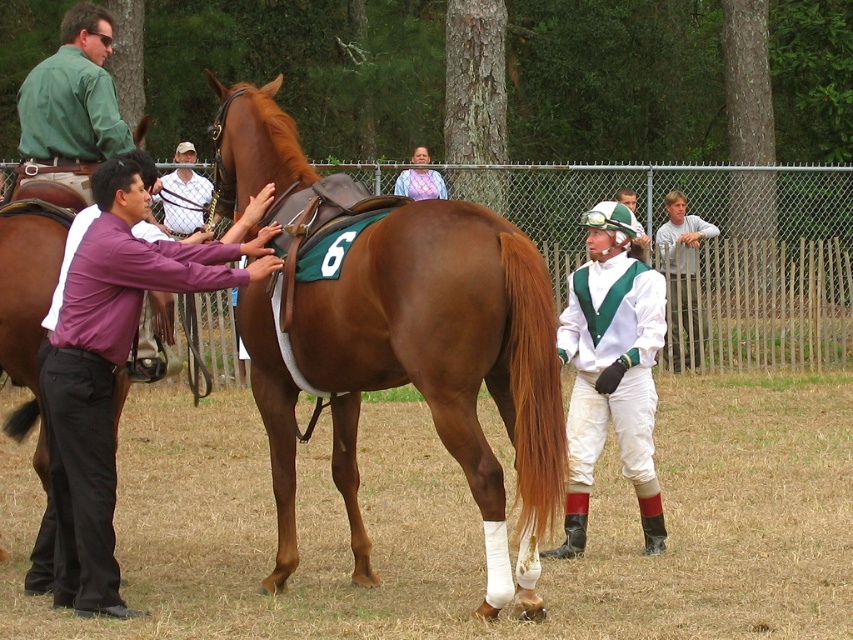
Question: Based on their relative distances, which object is farther from the white matte vest at center?

Choices:
 (A) white matte pants at center
 (B) white striped shirt at center

Answer: (B)

Question: Which object is farther from the camera taking this photo?

Choices:
 (A) pastel knitted sweater at center
 (B) white matte vest at center
 (C) green smooth shirt at upper left

Answer: (A)

Question: Does white matte pants at center appear on the left side of brown glossy saddle at left?

Choices:
 (A) no
 (B) yes

Answer: (A)

Question: Does shiny brown horse at center have a smaller size compared to white striped shirt at center?

Choices:
 (A) yes
 (B) no

Answer: (B)

Question: Can you confirm if brown glossy saddle at left is positioned above light brown wood fence at right?

Choices:
 (A) no
 (B) yes

Answer: (A)

Question: Which point is farther to the camera?

Choices:
 (A) (677, 269)
 (B) (396, 186)
 (C) (167, 198)
 (D) (48, 371)

Answer: (B)